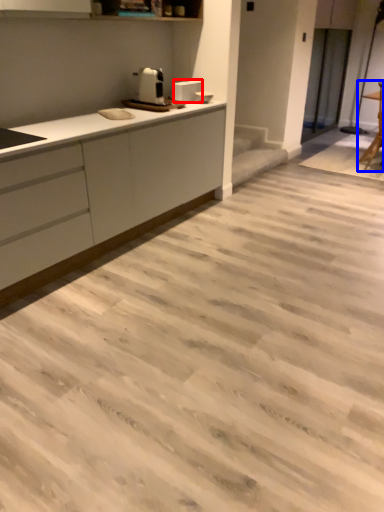
Question: Among these objects, which one is nearest to the camera, appliance (highlighted by a red box) or chair (highlighted by a blue box)?

Choices:
 (A) appliance
 (B) chair

Answer: (A)